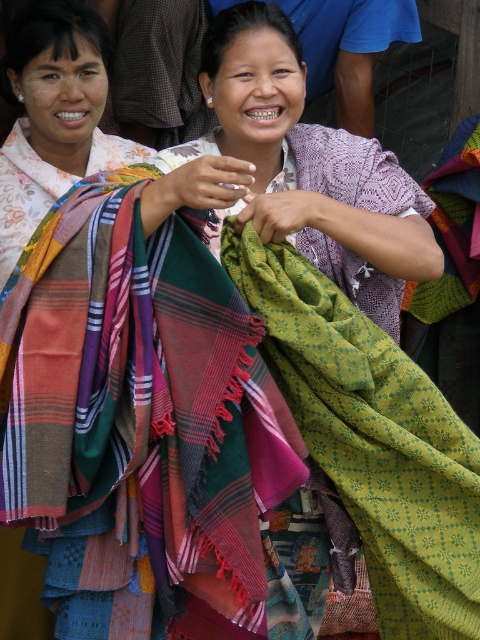
Between plaid wool scarf at center and plaid fabric scarf at left, which one appears on the left side from the viewer's perspective?

plaid fabric scarf at left

The image size is (480, 640). Describe the element at coordinates (144, 400) in the screenshot. I see `plaid wool scarf at center` at that location.

You are a GUI agent. You are given a task and a screenshot of the screen. Output one action in this format:
    pyautogui.click(x=<x>, y=<y>)
    Task: Click on the plaid wool scarf at center
    
    Given the screenshot: What is the action you would take?
    pyautogui.click(x=144, y=400)

Measure the distance between green woven shawl at center and camera.

The distance of green woven shawl at center from camera is 2.84 meters.

Who is lower down, green woven shawl at center or plaid fabric scarf at center?

Positioned lower is green woven shawl at center.

The height and width of the screenshot is (640, 480). In order to click on green woven shawl at center in this screenshot , I will do `click(372, 440)`.

At what (x,y) coordinates should I click in order to perform the action: click on green woven shawl at center. Please return your answer as a coordinate pair (x, y). Looking at the image, I should click on (372, 440).

Describe the element at coordinates (372, 440) in the screenshot. Image resolution: width=480 pixels, height=640 pixels. I see `green woven shawl at center` at that location.

Is point (468, 586) farther from camera compared to point (99, 141)?

No, (468, 586) is closer to viewer.

Does point (291, 342) come in front of point (16, 195)?

Yes, point (291, 342) is closer to viewer.

Where is `green woven shawl at center`? This screenshot has height=640, width=480. green woven shawl at center is located at coordinates (372, 440).